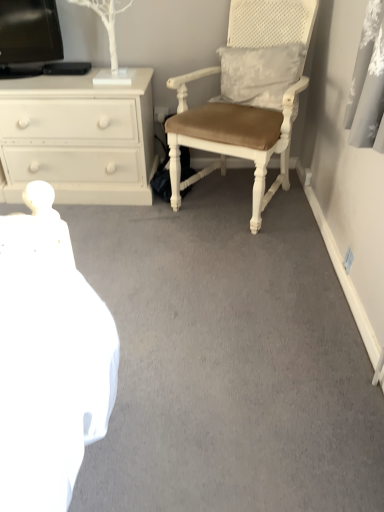
Question: Does white wood chair at right have a lesser width compared to white painted wood chest of drawers at left?

Choices:
 (A) no
 (B) yes

Answer: (A)

Question: Is white wood chair at right wider than white painted wood chest of drawers at left?

Choices:
 (A) no
 (B) yes

Answer: (B)

Question: Could you tell me if white wood chair at right is facing white painted wood chest of drawers at left?

Choices:
 (A) no
 (B) yes

Answer: (A)

Question: Considering the relative sizes of white wood chair at right and white painted wood chest of drawers at left in the image provided, is white wood chair at right taller than white painted wood chest of drawers at left?

Choices:
 (A) yes
 (B) no

Answer: (A)

Question: Is white wood chair at right to the right of white painted wood chest of drawers at left from the viewer's perspective?

Choices:
 (A) yes
 (B) no

Answer: (A)

Question: From a real-world perspective, is white wood chair at right on white painted wood chest of drawers at left?

Choices:
 (A) yes
 (B) no

Answer: (A)

Question: Is white painted wood chest of drawers at left smaller than white wood chair at right?

Choices:
 (A) no
 (B) yes

Answer: (B)

Question: Are white painted wood chest of drawers at left and white wood chair at right making contact?

Choices:
 (A) no
 (B) yes

Answer: (A)

Question: From the image's perspective, is white painted wood chest of drawers at left under white wood chair at right?

Choices:
 (A) yes
 (B) no

Answer: (A)

Question: Is white painted wood chest of drawers at left not close to white wood chair at right?

Choices:
 (A) no
 (B) yes

Answer: (A)

Question: Could you tell me if white painted wood chest of drawers at left is turned towards white wood chair at right?

Choices:
 (A) yes
 (B) no

Answer: (B)

Question: Is white painted wood chest of drawers at left to the right of white wood chair at right from the viewer's perspective?

Choices:
 (A) yes
 (B) no

Answer: (B)

Question: From the image's perspective, is white wood chair at right positioned above or below white painted wood chest of drawers at left?

Choices:
 (A) above
 (B) below

Answer: (A)